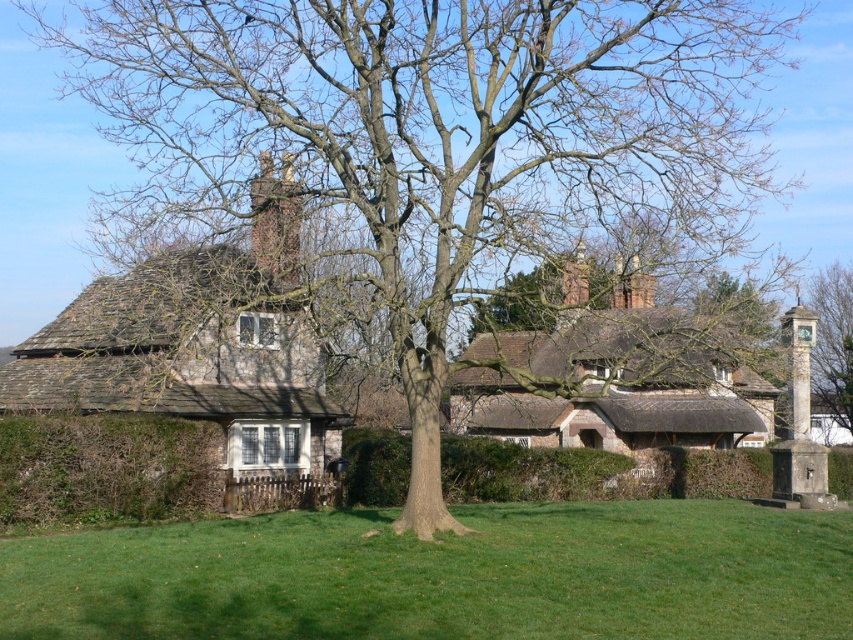
Can you confirm if green grass at center is positioned below brown textured chimney at upper center?

Yes, green grass at center is below brown textured chimney at upper center.

Is point (425, 612) closer to viewer compared to point (259, 220)?

Yes, it is in front of point (259, 220).

This screenshot has width=853, height=640. I want to click on green grass at center, so click(444, 576).

Between thatched roof cottage at center and green leafy hedge at lower left, which one appears on the left side from the viewer's perspective?

→ Positioned to the left is green leafy hedge at lower left.

Which is in front, point (683, 390) or point (28, 468)?

Point (28, 468) is in front.

This screenshot has height=640, width=853. What do you see at coordinates (613, 384) in the screenshot?
I see `thatched roof cottage at center` at bounding box center [613, 384].

This screenshot has height=640, width=853. Find the location of `thatched roof cottage at center`. thatched roof cottage at center is located at coordinates (613, 384).

Does thatched roof cottage at center have a smaller size compared to brown textured chimney at upper center?

No.

Can you confirm if thatched roof cottage at center is bigger than brown textured chimney at upper center?

Correct, thatched roof cottage at center is larger in size than brown textured chimney at upper center.

Describe the element at coordinates (613, 384) in the screenshot. I see `thatched roof cottage at center` at that location.

Find the location of a particular element. The height and width of the screenshot is (640, 853). thatched roof cottage at center is located at coordinates (613, 384).